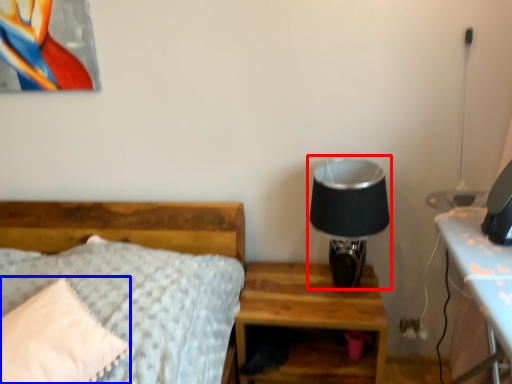
Question: Which object appears farthest to the camera in this image, table lamp (highlighted by a red box) or pillow (highlighted by a blue box)?

Choices:
 (A) table lamp
 (B) pillow

Answer: (A)